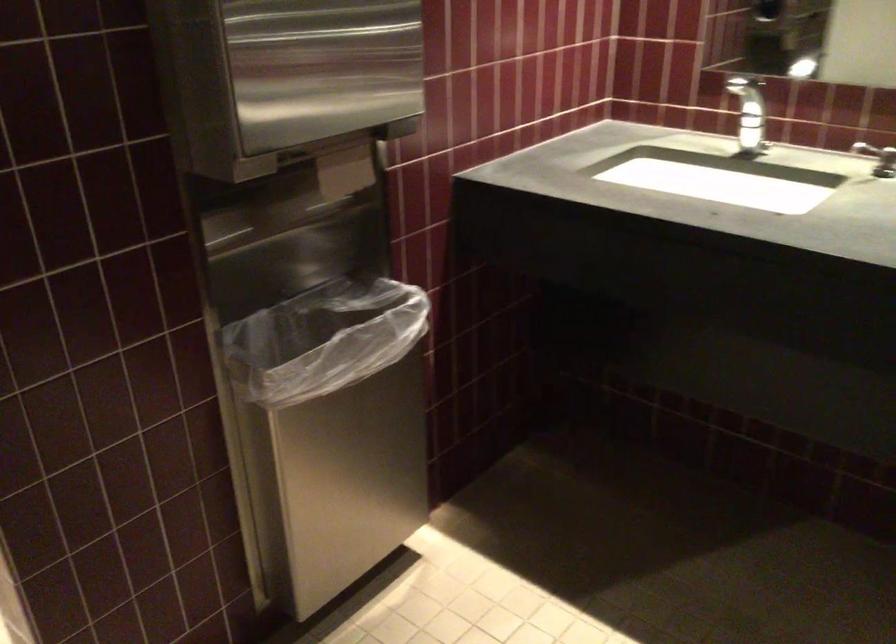
The image size is (896, 644). Describe the element at coordinates (282, 76) in the screenshot. I see `a paper towel opening` at that location.